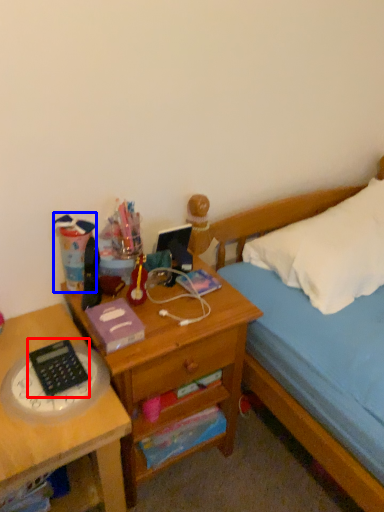
Question: Among these objects, which one is nearest to the camera, calculator (highlighted by a red box) or stationery (highlighted by a blue box)?

Choices:
 (A) calculator
 (B) stationery

Answer: (A)